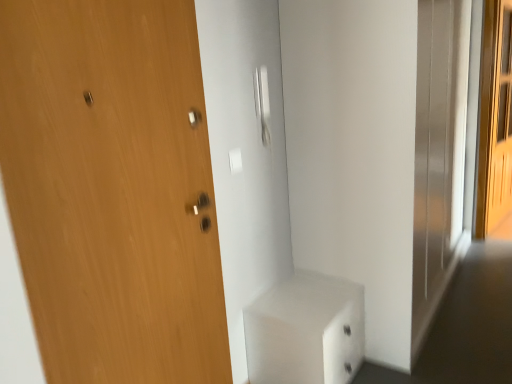
Question: Can you confirm if white glossy cabinet at lower center is positioned to the left of satin silver door handle at center?

Choices:
 (A) no
 (B) yes

Answer: (A)

Question: Considering the relative sizes of white glossy cabinet at lower center and satin silver door handle at center in the image provided, is white glossy cabinet at lower center thinner than satin silver door handle at center?

Choices:
 (A) yes
 (B) no

Answer: (B)

Question: Would you say white glossy cabinet at lower center is a long distance from satin silver door handle at center?

Choices:
 (A) no
 (B) yes

Answer: (A)

Question: Is white glossy cabinet at lower center turned away from satin silver door handle at center?

Choices:
 (A) yes
 (B) no

Answer: (B)

Question: Is white glossy cabinet at lower center aimed at satin silver door handle at center?

Choices:
 (A) no
 (B) yes

Answer: (A)

Question: From the image's perspective, would you say white glossy cabinet at lower center is positioned over satin silver door handle at center?

Choices:
 (A) no
 (B) yes

Answer: (A)

Question: Is light brown wooden screen door at right at the left side of wooden door at left?

Choices:
 (A) yes
 (B) no

Answer: (B)

Question: From a real-world perspective, does light brown wooden screen door at right stand above wooden door at left?

Choices:
 (A) yes
 (B) no

Answer: (A)

Question: Does light brown wooden screen door at right lie behind wooden door at left?

Choices:
 (A) no
 (B) yes

Answer: (B)

Question: Does light brown wooden screen door at right have a lesser height compared to wooden door at left?

Choices:
 (A) yes
 (B) no

Answer: (B)

Question: Considering the relative sizes of light brown wooden screen door at right and wooden door at left in the image provided, is light brown wooden screen door at right bigger than wooden door at left?

Choices:
 (A) no
 (B) yes

Answer: (B)

Question: From the image's perspective, is light brown wooden screen door at right beneath wooden door at left?

Choices:
 (A) no
 (B) yes

Answer: (A)

Question: Is white glossy cabinet at lower center looking in the opposite direction of wooden door at left?

Choices:
 (A) yes
 (B) no

Answer: (B)